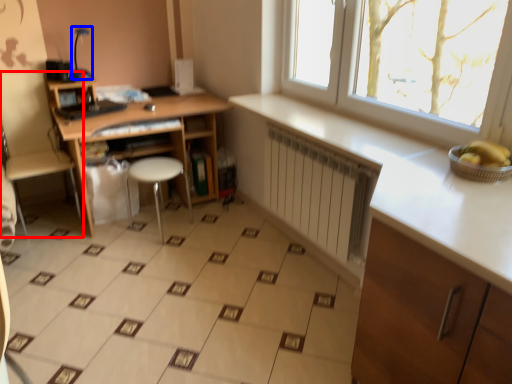
Question: Among these objects, which one is farthest to the camera, swivel chair (highlighted by a red box) or lamp (highlighted by a blue box)?

Choices:
 (A) swivel chair
 (B) lamp

Answer: (B)